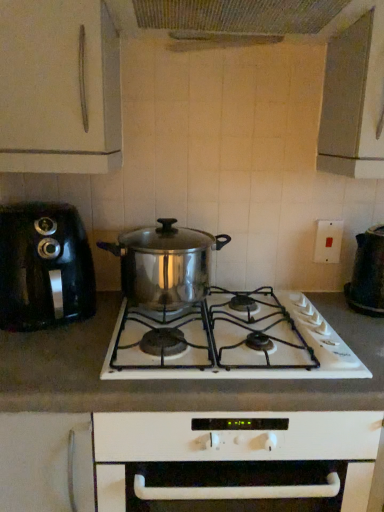
Question: From the image's perspective, is stainless steel pot at center located above or below black plastic kettle at right, the 1th kitchen appliance viewed from the right?

Choices:
 (A) below
 (B) above

Answer: (A)

Question: In the image, is stainless steel pot at center positioned in front of or behind black plastic kettle at right, which is the 2th kitchen appliance in left-to-right order?

Choices:
 (A) behind
 (B) front

Answer: (B)

Question: Which is nearer to the black plastic kettle at right, the 1th kitchen appliance viewed from the right?

Choices:
 (A) stainless steel pot at center
 (B) stainless steel pot at center
 (C) white matte countertop at center
 (D) metallic mesh at upper center
 (E) white plastic switch at upper right

Answer: (E)

Question: Based on their relative distances, which object is farther from the white plastic switch at upper right?

Choices:
 (A) stainless steel pot at center
 (B) black plastic toaster at left, acting as the 1th kitchen appliance starting from the left
 (C) metallic mesh at upper center
 (D) stainless steel pot at center
 (E) white matte countertop at center

Answer: (B)